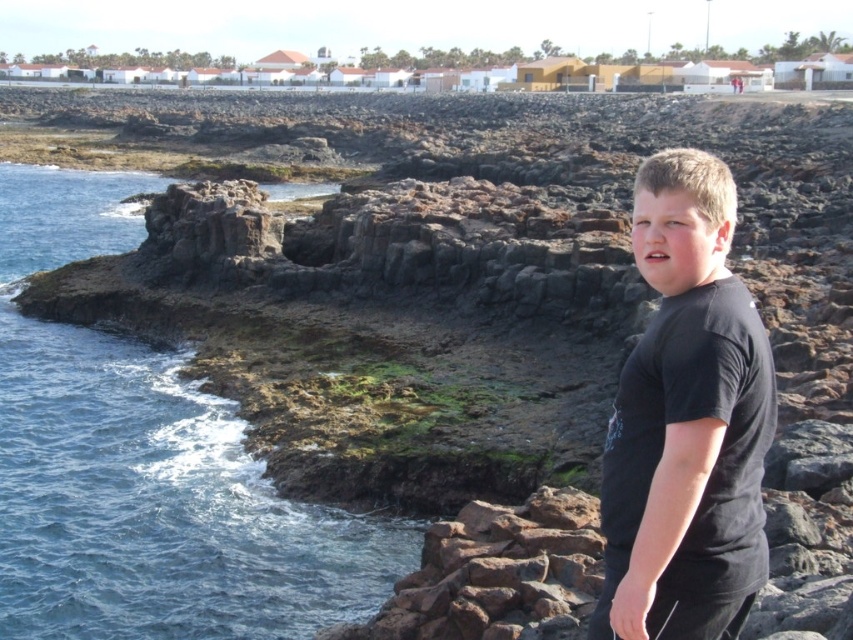
Question: Among these points, which one is nearest to the camera?

Choices:
 (A) (636, 620)
 (B) (120, 376)

Answer: (A)

Question: Can you confirm if blue water at left is positioned below black matte shirt at right?

Choices:
 (A) no
 (B) yes

Answer: (A)

Question: Observing the image, what is the correct spatial positioning of blue water at left in reference to black matte shirt at right?

Choices:
 (A) left
 (B) right

Answer: (A)

Question: Does blue water at left come in front of black matte shirt at right?

Choices:
 (A) yes
 (B) no

Answer: (B)

Question: Among these points, which one is farthest from the camera?

Choices:
 (A) (685, 476)
 (B) (76, 364)

Answer: (B)

Question: Which point is farther from the camera taking this photo?

Choices:
 (A) (635, 180)
 (B) (345, 557)

Answer: (A)